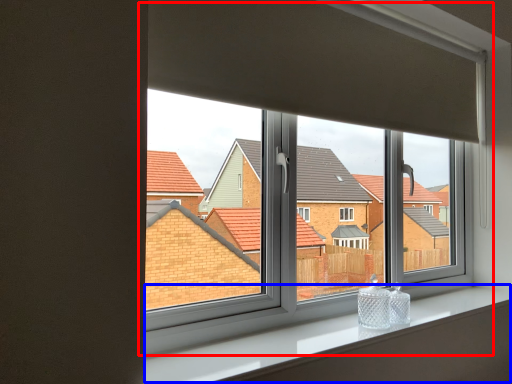
Question: Which object is further to the camera taking this photo, window (highlighted by a red box) or window sill (highlighted by a blue box)?

Choices:
 (A) window
 (B) window sill

Answer: (A)